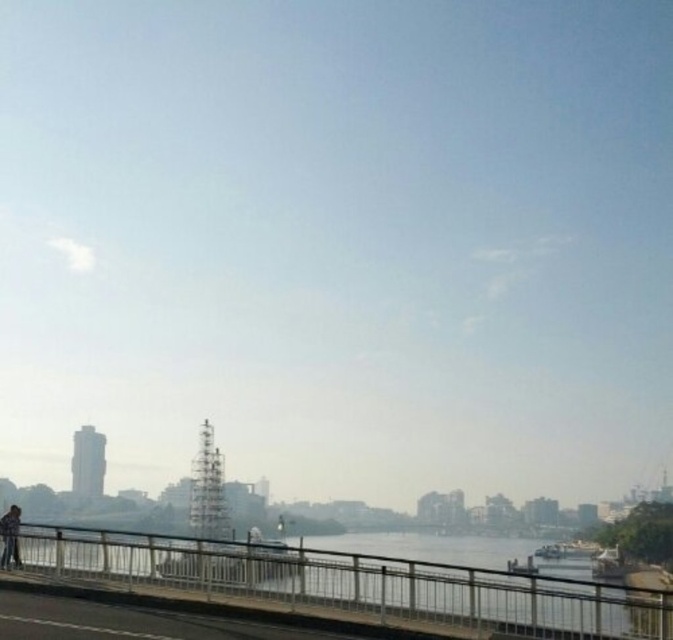
You are standing on a bridge overlooking the river. You notice a metallic silver railing at lower center and dark blue jeans at lower left. Which object is positioned to the right of the other?

The metallic silver railing at lower center is positioned to the right of the dark blue jeans at lower left.

You are a photographer trying to capture a clear shot of the city skyline. You notice the metallic silver railing at lower center and the dark blue jeans at lower left in your frame. Which object should you avoid blocking to ensure the city view remains unobstructed?

The metallic silver railing at lower center is above the dark blue jeans at lower left. To keep the city skyline visible, avoid blocking the metallic silver railing at lower center since it is positioned higher and closer to the city view.

You are trying to cross the bridge shown in the image. You need to walk between the metallic silver railing at lower center and the dark blue jeans at lower left. Is there enough space for you to pass through?

The metallic silver railing at lower center might be wider than dark blue jeans at lower left, so there may not be enough space to pass through safely. It is recommended to find another path or check the actual width before proceeding.